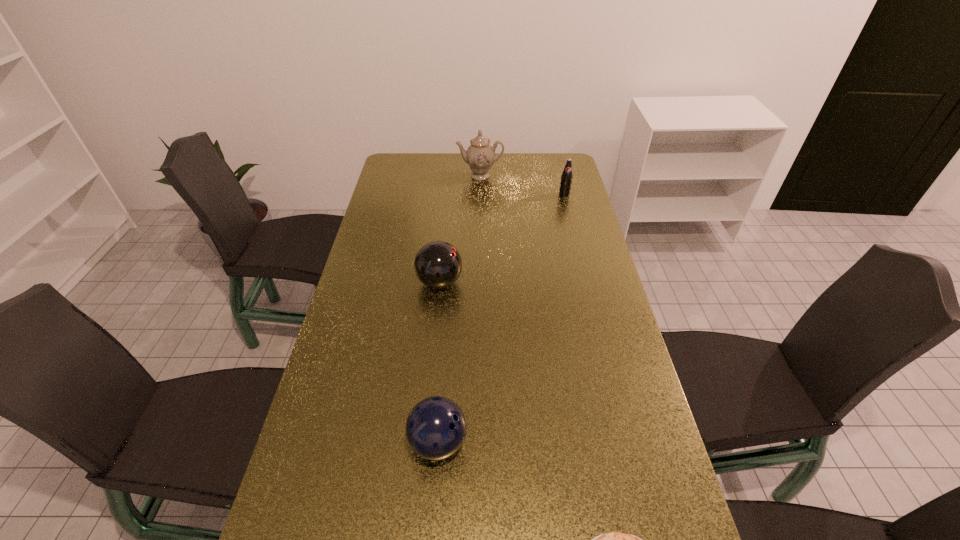
Locate an element on the screen. The image size is (960, 540). the farthest object is located at coordinates (480, 154).

Locate an element on the screen. chinaware is located at coordinates (480, 154).

I want to click on the fourth nearest object, so click(566, 178).

The height and width of the screenshot is (540, 960). What are the coordinates of `the farther bowling ball` in the screenshot? It's located at (438, 264).

This screenshot has width=960, height=540. Identify the location of the nearer bowling ball. (436, 427).

This screenshot has width=960, height=540. In order to click on vacant space situated 0.340m on the spout of the tallest object in this screenshot , I will do `click(480, 232)`.

At what (x,y) coordinates should I click in order to perform the action: click on free location located 0.400m on the front label of the pop. Please return your answer as a coordinate pair (x, y). Looking at the image, I should click on (582, 262).

Identify the location of vacant space located 0.110m on the surface of the third nearest object near the finger holes. (497, 282).

Where is `blank space located on the surface of the nearer bowling ball near the finger holes`? The height and width of the screenshot is (540, 960). blank space located on the surface of the nearer bowling ball near the finger holes is located at coordinates (579, 442).

Locate an element on the screen. This screenshot has width=960, height=540. object present at the far edge is located at coordinates (480, 154).